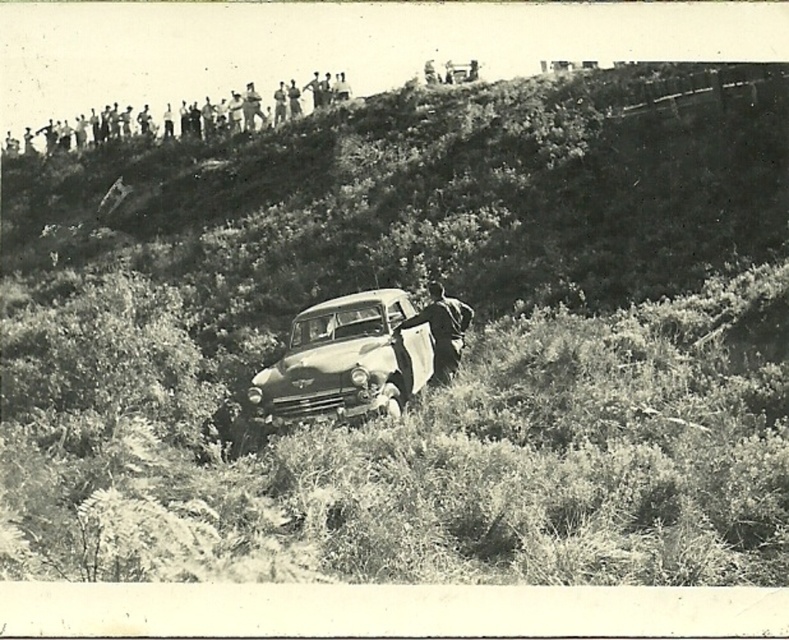
Question: From the image, what is the correct spatial relationship of shiny silver sedan at center in relation to metallic silver pickup truck at center?

Choices:
 (A) above
 (B) below

Answer: (B)

Question: Which object appears closest to the camera in this image?

Choices:
 (A) shiny silver sedan at center
 (B) metallic silver pickup truck at center

Answer: (A)

Question: Is shiny silver sedan at center above metallic silver pickup truck at center?

Choices:
 (A) yes
 (B) no

Answer: (B)

Question: Which point appears closest to the camera in this image?

Choices:
 (A) (445, 358)
 (B) (354, 346)

Answer: (B)

Question: Is shiny silver sedan at center bigger than metallic silver pickup truck at center?

Choices:
 (A) no
 (B) yes

Answer: (B)